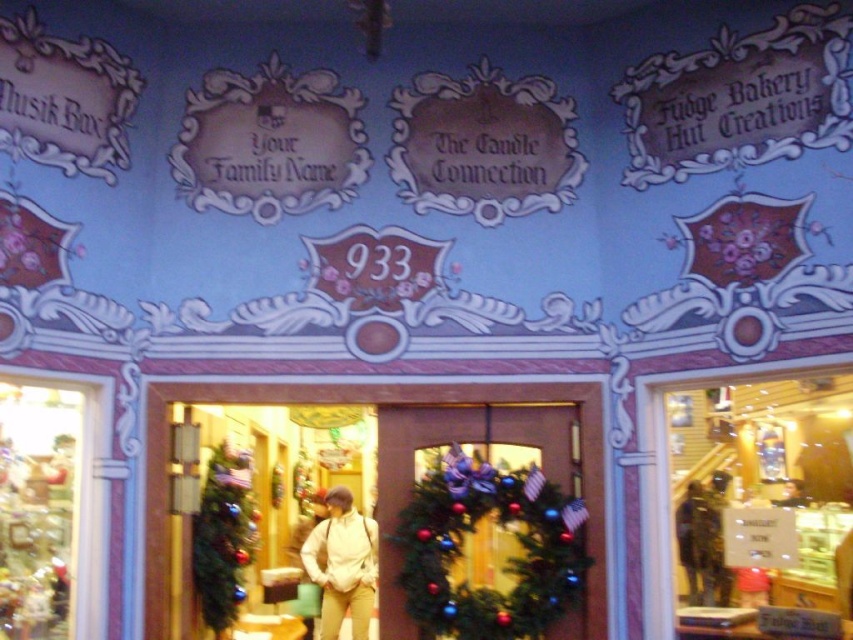
Question: Which point is farther to the camera?

Choices:
 (A) translucent glass display case at right
 (B) white matte jacket at center

Answer: (B)

Question: Can you confirm if translucent glass ornaments at left is positioned below green matte christmas tree at lower left?

Choices:
 (A) no
 (B) yes

Answer: (A)

Question: Observing the image, what is the correct spatial positioning of translucent glass display case at right in reference to translucent glass ornaments at left?

Choices:
 (A) above
 (B) below

Answer: (A)

Question: Based on their relative distances, which object is farther from the translucent glass ornaments at left?

Choices:
 (A) green matte christmas tree at lower left
 (B) white matte jacket at center
 (C) green matte wreath at center
 (D) translucent glass display case at right

Answer: (D)

Question: Where is translucent glass ornaments at left located in relation to white matte jacket at center in the image?

Choices:
 (A) above
 (B) below

Answer: (A)

Question: Which object appears farthest from the camera in this image?

Choices:
 (A) green matte wreath at center
 (B) green matte christmas tree at lower left
 (C) translucent glass display case at right

Answer: (B)